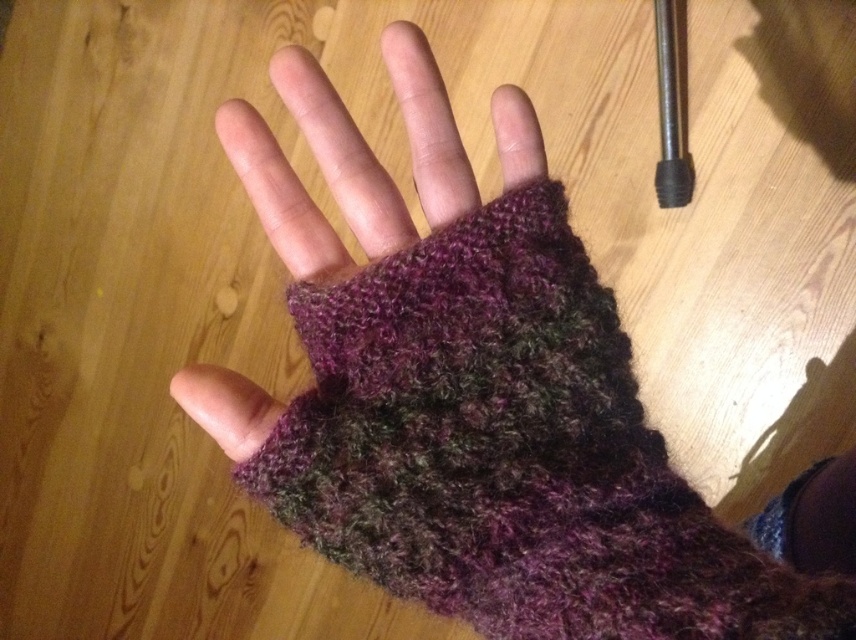
Question: Which object appears farthest from the camera in this image?

Choices:
 (A) fuzzy woolen fingerless glove at center
 (B) knitted wool sock at lower right

Answer: (B)

Question: Which point is farther to the camera?

Choices:
 (A) (446, 192)
 (B) (797, 522)

Answer: (B)

Question: Is multicolor knitted fingerless glove at center below knitted wool sock at lower right?

Choices:
 (A) no
 (B) yes

Answer: (A)

Question: In this image, where is multicolor knitted fingerless glove at center located relative to knitted wool sock at lower right?

Choices:
 (A) below
 (B) above

Answer: (B)

Question: Which point is farther to the camera?

Choices:
 (A) fuzzy woolen fingerless glove at center
 (B) knitted wool sock at lower right

Answer: (B)

Question: Is multicolor knitted fingerless glove at center positioned at the back of fuzzy woolen fingerless glove at center?

Choices:
 (A) no
 (B) yes

Answer: (A)